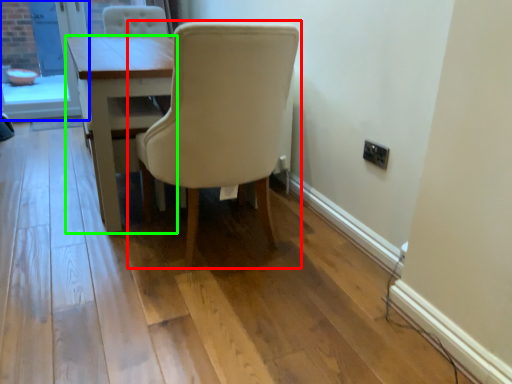
Question: Considering the real-world distances, which object is farthest from chair (highlighted by a red box)? screen door (highlighted by a blue box) or table (highlighted by a green box)?

Choices:
 (A) screen door
 (B) table

Answer: (A)